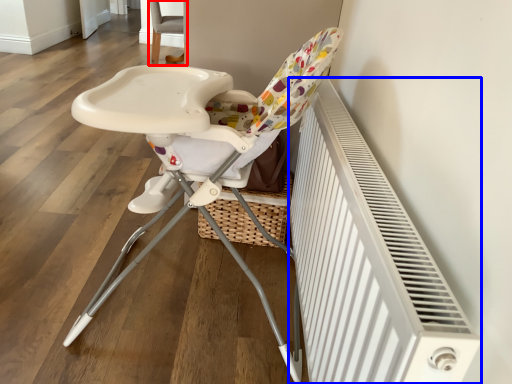
Question: Among these objects, which one is farthest to the camera, chair (highlighted by a red box) or radiator (highlighted by a blue box)?

Choices:
 (A) chair
 (B) radiator

Answer: (A)